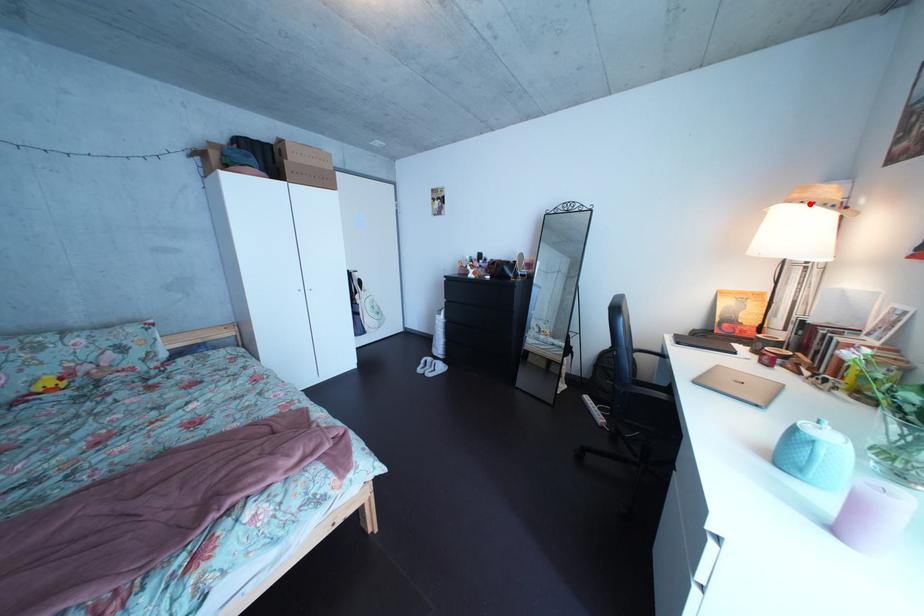
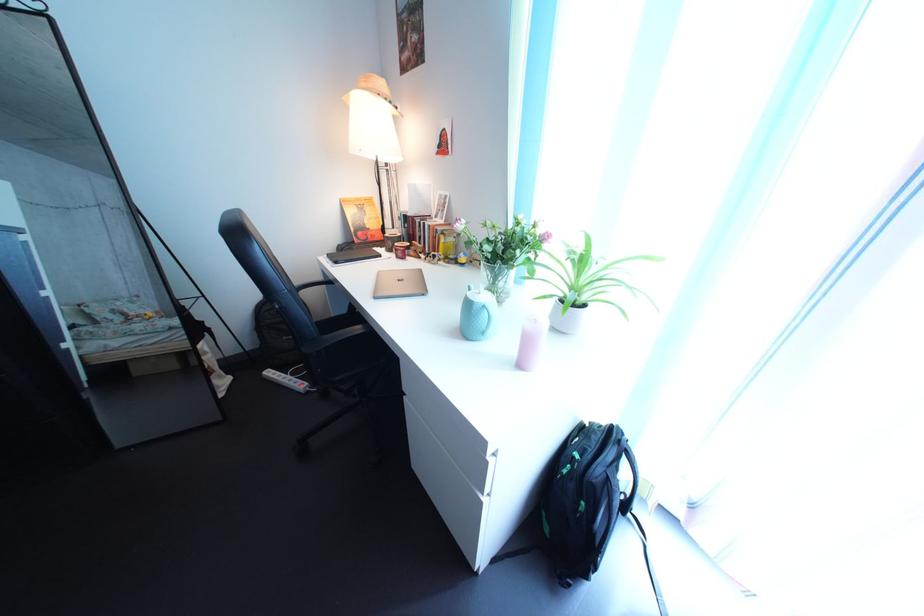
Question: I am providing you with two images of the same scene from different viewpoints. Image1 has a red point marked. In image2, the corresponding 3D location appears at what relative position? Reply with the corresponding letter.

Choices:
 (A) Closer
 (B) Farther

Answer: (A)